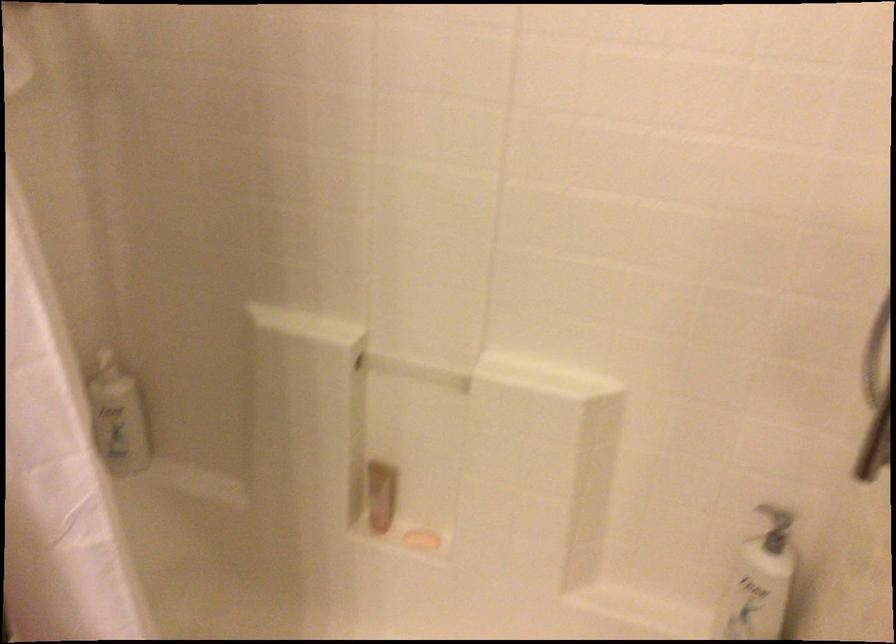
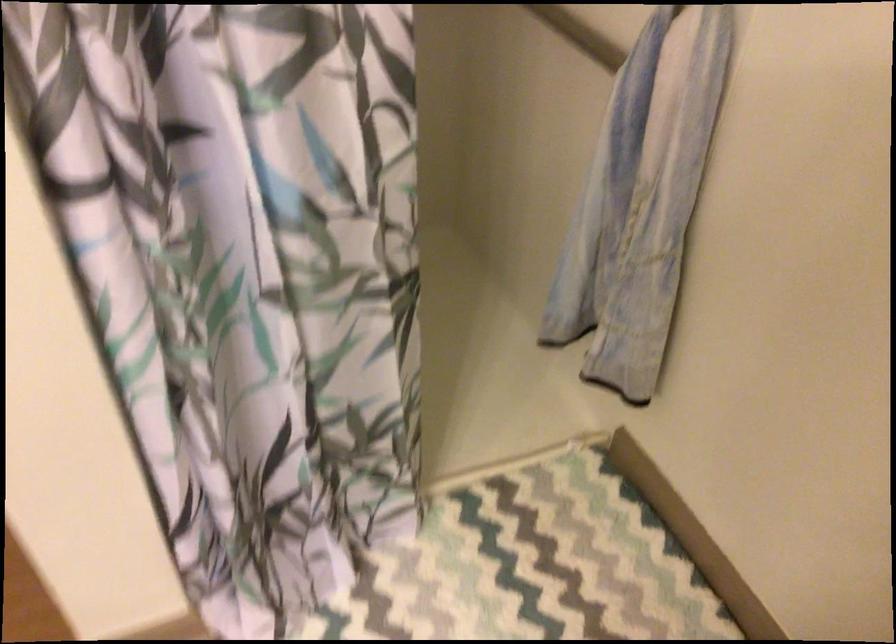
How did the camera likely rotate?

The rotation direction of the camera is right-down.